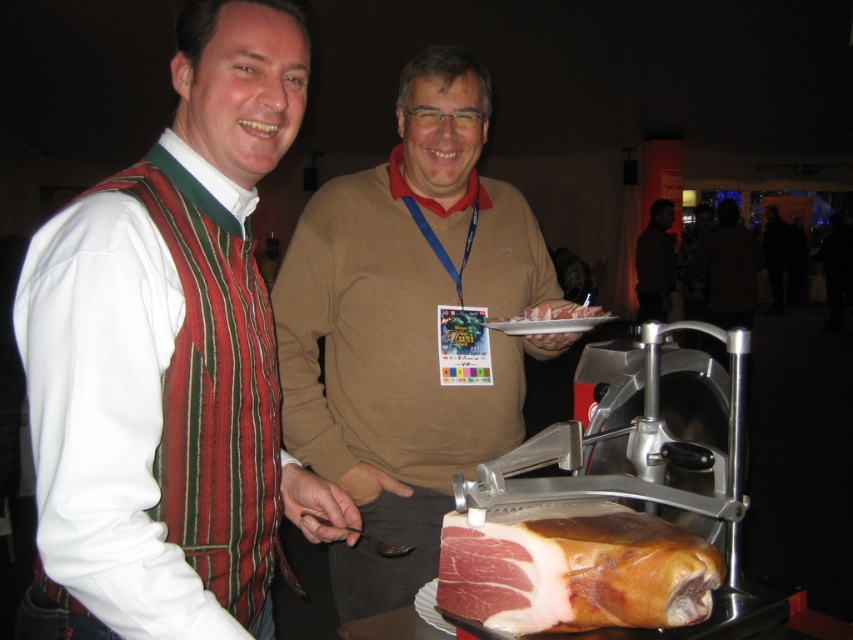
Question: Is brown fabric shirt at center above pinkish raw meat at center?

Choices:
 (A) no
 (B) yes

Answer: (B)

Question: Which of the following is the closest to the observer?

Choices:
 (A) (508, 433)
 (B) (648, 237)
 (C) (555, 304)

Answer: (C)

Question: Considering the real-world distances, which object is closest to the white cotton shirt at left?

Choices:
 (A) matte brown sweater at center
 (B) brown fabric shirt at center

Answer: (A)

Question: Based on their relative distances, which object is nearer to the dark brown leather jacket at upper right?

Choices:
 (A) pinkish-red cured meat at center
 (B) matte brown sweater at center
 (C) white cotton shirt at left
 (D) brown fabric shirt at center

Answer: (D)

Question: Does dark brown leather jacket at upper right have a smaller size compared to pinkish raw meat at center?

Choices:
 (A) yes
 (B) no

Answer: (B)

Question: Does pinkish-red cured meat at center have a smaller size compared to pinkish raw meat at center?

Choices:
 (A) no
 (B) yes

Answer: (A)